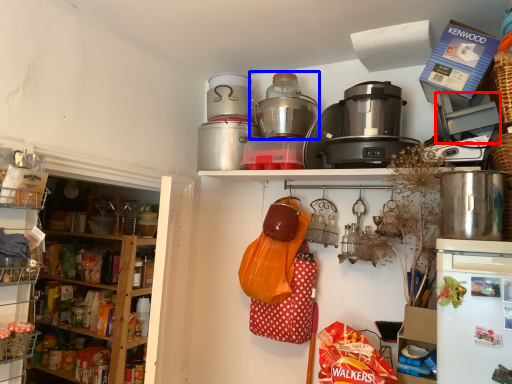
Question: Among these objects, which one is nearest to the camera, appliance (highlighted by a red box) or rice cooker (highlighted by a blue box)?

Choices:
 (A) appliance
 (B) rice cooker

Answer: (A)